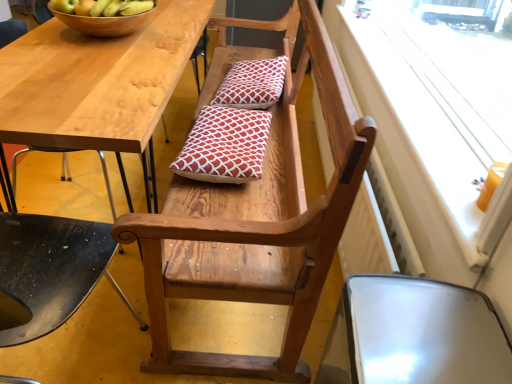
The width and height of the screenshot is (512, 384). I want to click on empty space that is ontop of white matte window screen at upper right (from a real-world perspective), so click(413, 53).